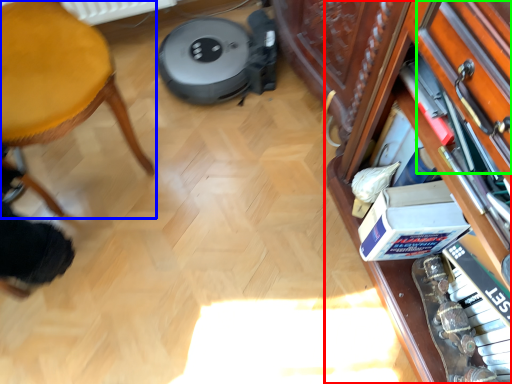
Question: Estimate the real-world distances between objects in this image. Which object is closer to shelf (highlighted by a red box), furniture (highlighted by a blue box) or drawer (highlighted by a green box)?

Choices:
 (A) furniture
 (B) drawer

Answer: (B)